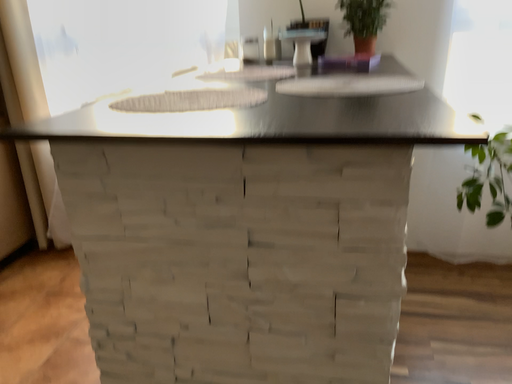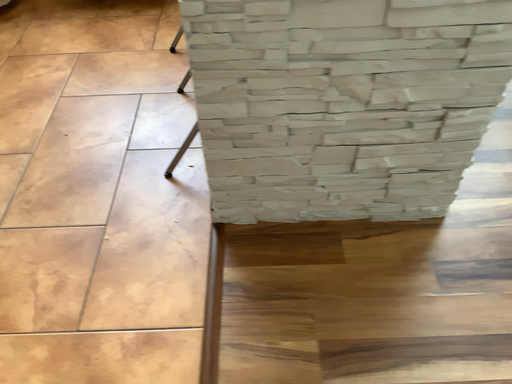
Question: Which way did the camera rotate in the video?

Choices:
 (A) rotated right
 (B) rotated left

Answer: (A)